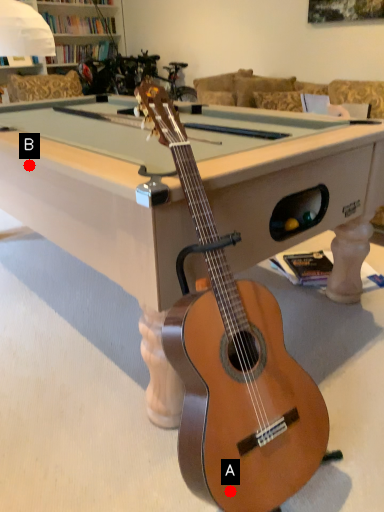
Question: Two points are circled on the image, labeled by A and B beside each circle. Which point appears closest to the camera in this image?

Choices:
 (A) A is closer
 (B) B is closer

Answer: (A)